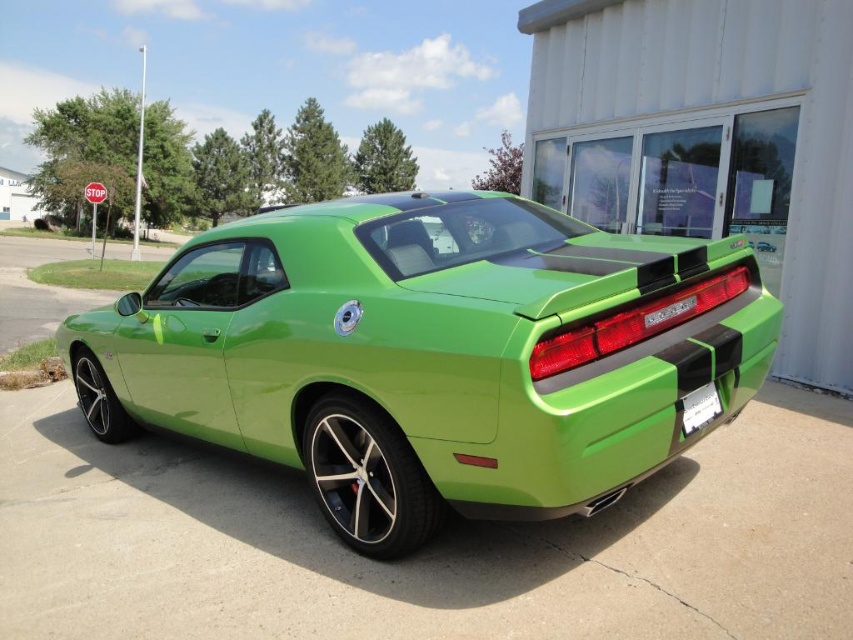
Question: Which of the following is the farthest from the observer?

Choices:
 (A) lime green matte car at center
 (B) white plastic license plate at lower right

Answer: (B)

Question: Which object appears farthest from the camera in this image?

Choices:
 (A) white plastic license plate at lower right
 (B) lime green matte car at center

Answer: (A)

Question: Does lime green matte car at center appear under white plastic license plate at lower right?

Choices:
 (A) no
 (B) yes

Answer: (A)

Question: Observing the image, what is the correct spatial positioning of lime green matte car at center in reference to white plastic license plate at lower right?

Choices:
 (A) left
 (B) right

Answer: (A)

Question: Does lime green matte car at center come behind white plastic license plate at lower right?

Choices:
 (A) no
 (B) yes

Answer: (A)